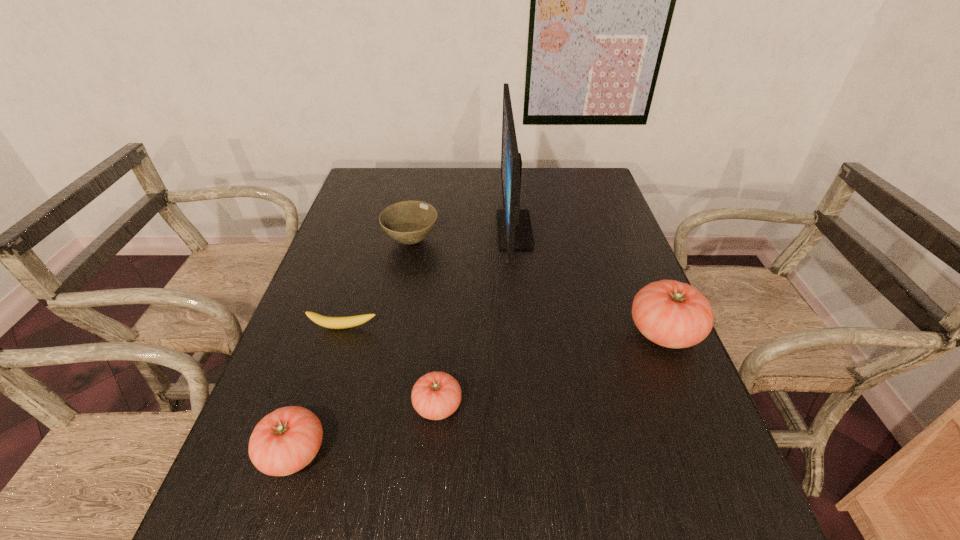
At what (x,y) coordinates should I click in order to perform the action: click on object that stands as the fifth closest to the second object from right to left. Please return your answer as a coordinate pair (x, y). The width and height of the screenshot is (960, 540). Looking at the image, I should click on (286, 440).

I want to click on tomato that can be found as the closest to the second shortest object, so click(x=286, y=440).

The image size is (960, 540). Identify the location of tomato that is the third closest to the shortest object. (672, 314).

What are the coordinates of `free space that satisfies the following two spatial constraints: 1. on the back side of the bowl; 2. on the right side of the leftmost tomato` in the screenshot? It's located at (364, 241).

The width and height of the screenshot is (960, 540). Identify the location of free point that satisfies the following two spatial constraints: 1. on the upward curve of the shortest object; 2. on the right side of the fifth tallest object. (319, 406).

This screenshot has height=540, width=960. I want to click on vacant point that satisfies the following two spatial constraints: 1. on the screen side of the tallest object; 2. on the upward curve of the shortest object, so click(524, 327).

Where is `free space that satisfies the following two spatial constraints: 1. on the front side of the bowl; 2. on the right side of the second tallest object`? The height and width of the screenshot is (540, 960). free space that satisfies the following two spatial constraints: 1. on the front side of the bowl; 2. on the right side of the second tallest object is located at coordinates (394, 332).

This screenshot has width=960, height=540. In order to click on free spot that satisfies the following two spatial constraints: 1. on the upward curve of the rightmost tomato; 2. on the right side of the banana in this screenshot , I will do `click(342, 332)`.